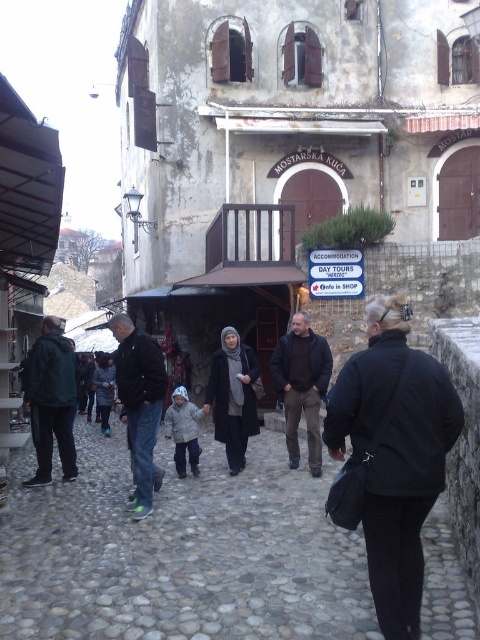
Who is positioned more to the right, black matte jacket at lower right or dark gray woolen coat at lower left?

black matte jacket at lower right

Is black matte jacket at lower right to the left of dark gray woolen coat at lower left from the viewer's perspective?

In fact, black matte jacket at lower right is to the right of dark gray woolen coat at lower left.

Which is in front, point (336, 477) or point (113, 378)?

Positioned in front is point (336, 477).

The width and height of the screenshot is (480, 640). In order to click on black matte jacket at lower right in this screenshot , I will do `click(391, 458)`.

Is point (359, 280) farther from camera compared to point (99, 376)?

That is False.

Does blue plastic signboard at center appear over dark gray woolen coat at lower left?

Correct, blue plastic signboard at center is located above dark gray woolen coat at lower left.

Is point (328, 276) farther from viewer compared to point (105, 387)?

No, it is in front of (105, 387).

What are the coordinates of `blue plastic signboard at center` in the screenshot? It's located at (336, 273).

Between dark brown leather jacket at center and dark gray woolen coat at lower left, which one appears on the left side from the viewer's perspective?

dark gray woolen coat at lower left

Can you confirm if dark brown leather jacket at center is thinner than dark gray woolen coat at lower left?

No.

Find the location of a particular element. This screenshot has width=480, height=640. dark brown leather jacket at center is located at coordinates (301, 387).